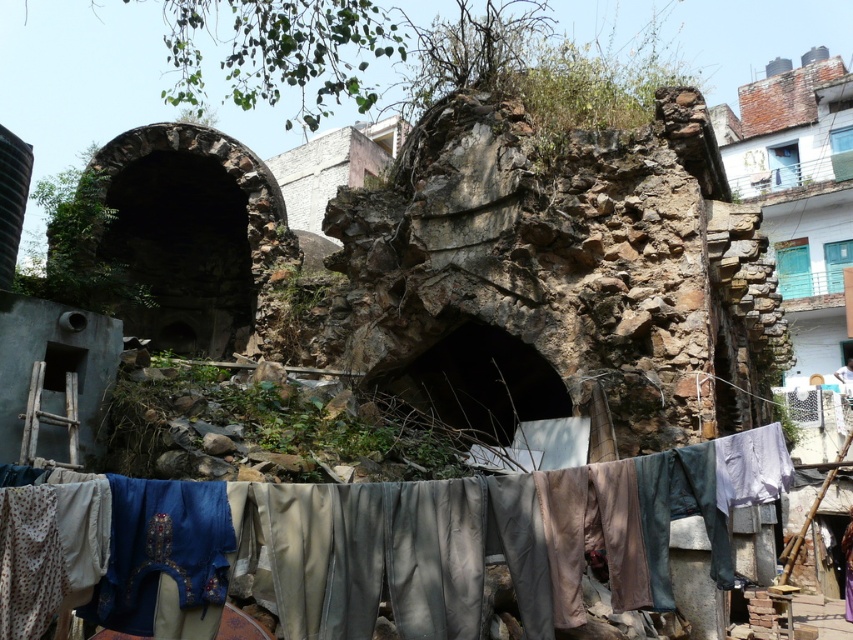
Question: Which object appears farthest from the camera in this image?

Choices:
 (A) rustic stone wall at upper right
 (B) rusty stone arch at upper center
 (C) textured fabric clothesline at center

Answer: (B)

Question: Which object is farther from the camera taking this photo?

Choices:
 (A) rusty stone arch at upper center
 (B) rustic stone wall at upper right

Answer: (A)

Question: Does textured fabric clothesline at center appear on the left side of rusty stone arch at upper center?

Choices:
 (A) no
 (B) yes

Answer: (A)

Question: Is textured fabric clothesline at center below rustic stone wall at upper right?

Choices:
 (A) yes
 (B) no

Answer: (A)

Question: Is textured fabric clothesline at center positioned before rusty stone arch at upper center?

Choices:
 (A) no
 (B) yes

Answer: (B)

Question: Among these objects, which one is farthest from the camera?

Choices:
 (A) textured fabric clothesline at center
 (B) rustic stone wall at upper right
 (C) rusty stone arch at upper center

Answer: (C)